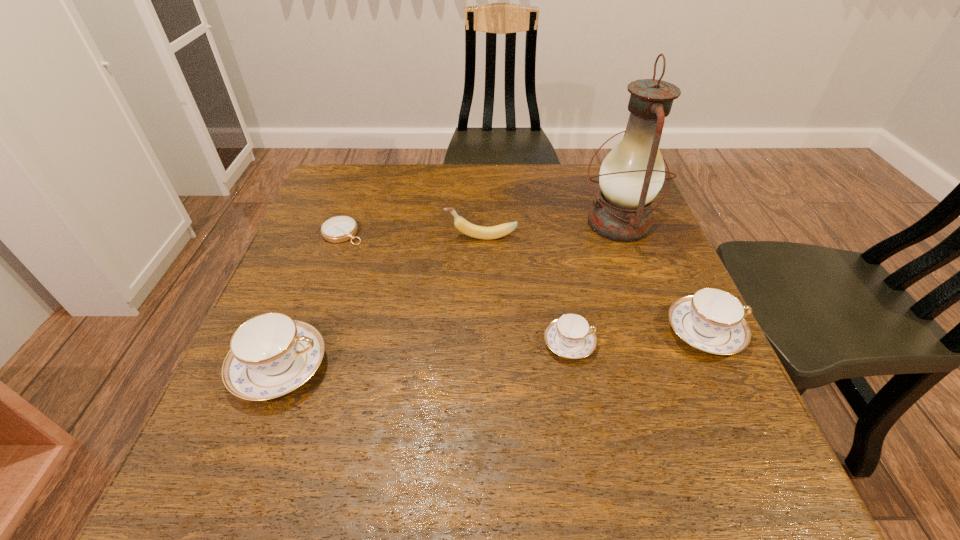
I want to click on the leftmost teacup, so click(x=270, y=355).

The height and width of the screenshot is (540, 960). Identify the location of the second shortest object. (570, 336).

Where is `the shortest teacup`? The width and height of the screenshot is (960, 540). the shortest teacup is located at coordinates (570, 336).

Identify the location of the second shortest teacup. click(712, 320).

Where is `the third object from left to right`? the third object from left to right is located at coordinates (486, 233).

The height and width of the screenshot is (540, 960). I want to click on the tallest object, so click(x=631, y=175).

The height and width of the screenshot is (540, 960). I want to click on the shortest object, so click(x=338, y=229).

Where is `free spot located on the side with the handle of the leftmost teacup`? The width and height of the screenshot is (960, 540). free spot located on the side with the handle of the leftmost teacup is located at coordinates point(507,367).

This screenshot has width=960, height=540. I want to click on free space located on the side with the handle of the second teacup from left to right, so click(x=709, y=343).

At what (x,y) coordinates should I click in order to perform the action: click on blank space located 0.350m at the stem of the banana. Please return your answer as a coordinate pair (x, y). Image resolution: width=960 pixels, height=540 pixels. Looking at the image, I should click on (303, 238).